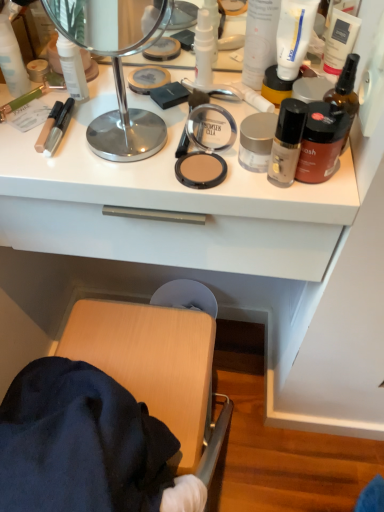
You are a GUI agent. You are given a task and a screenshot of the screen. Output one action in this format:
    pyautogui.click(x=<x>, y=<y>)
    Task: Click on the free point in front of white matte spray bottle at center, which appears as the third toiletry when viewed from the left
    The image size is (384, 512).
    Given the screenshot: What is the action you would take?
    pyautogui.click(x=173, y=139)